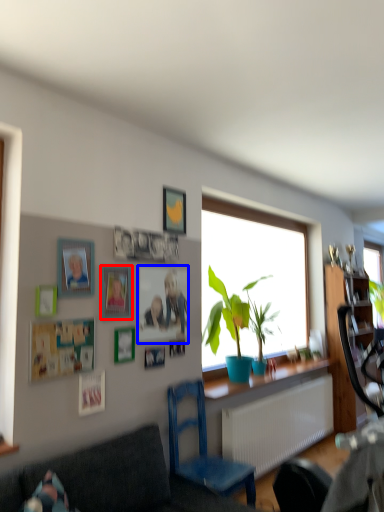
Question: Which object appears farthest to the camera in this image, picture frame (highlighted by a red box) or picture frame (highlighted by a blue box)?

Choices:
 (A) picture frame
 (B) picture frame

Answer: (B)